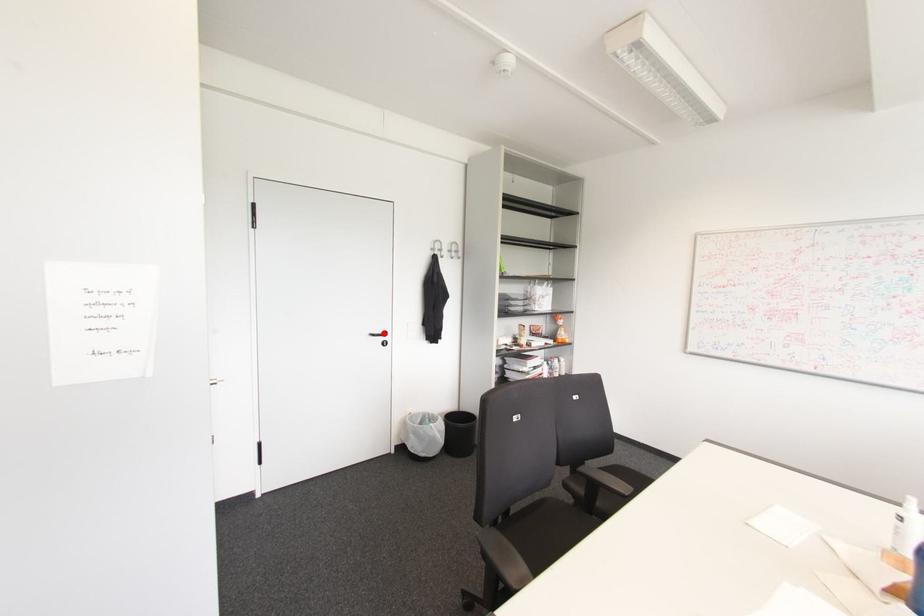
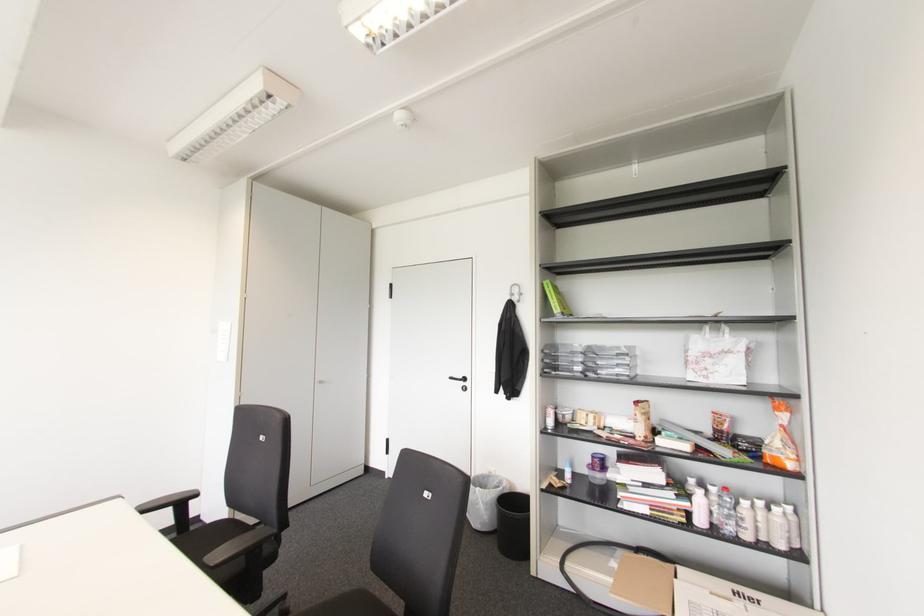
In the second image, find the point that corresponds to the highlighted location in the first image.

(464, 379)